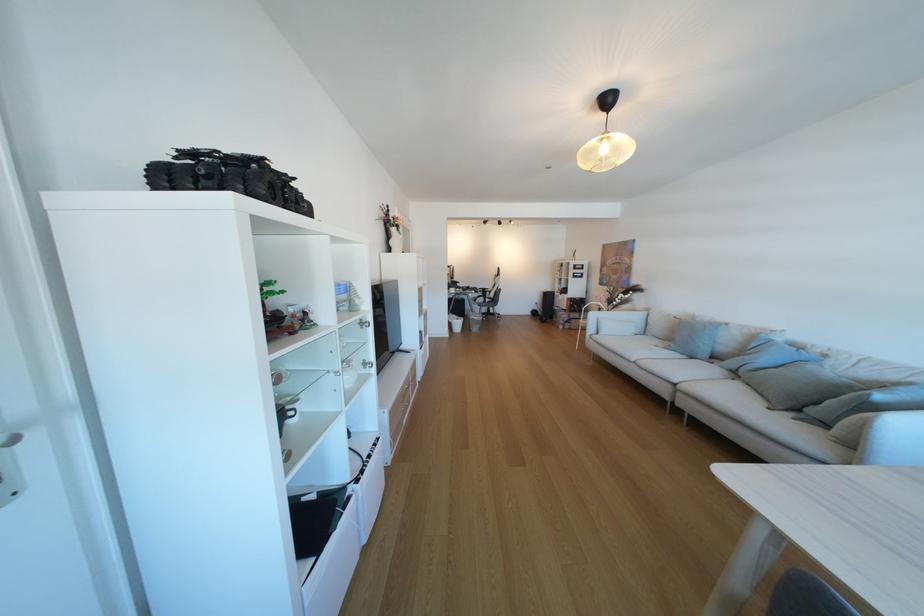
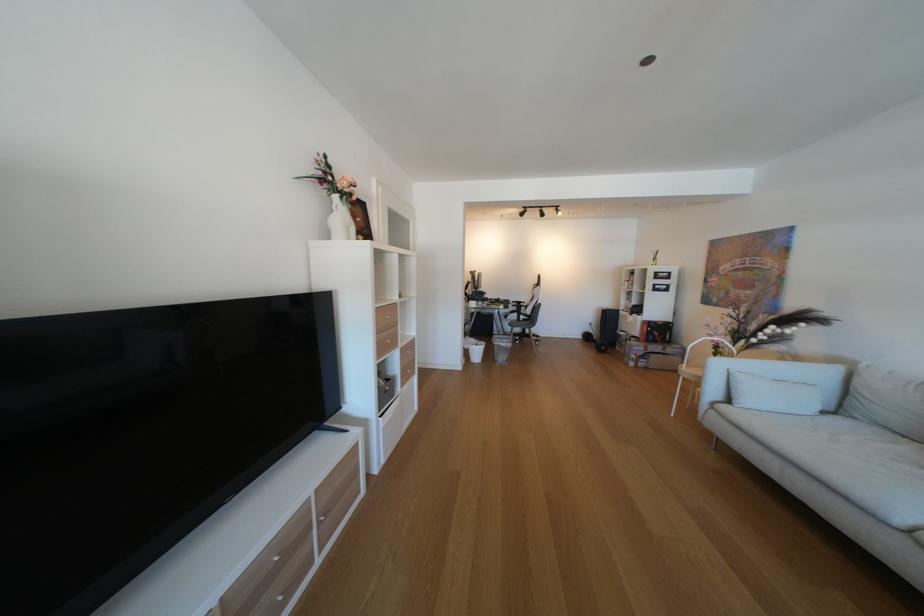
The point at [502,317] is marked in the first image. Where is the corresponding point in the second image?

(537, 339)